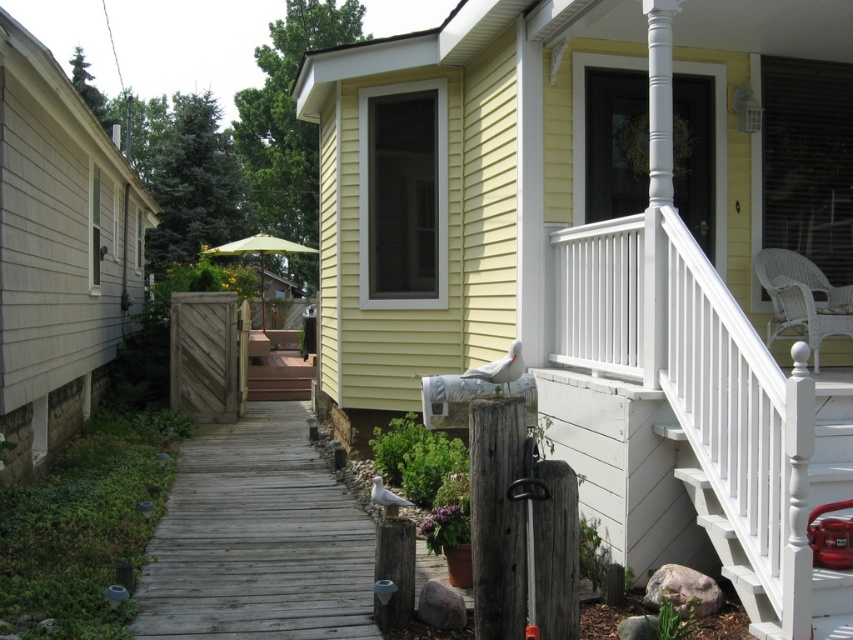
Is weathered wood deck at center to the right of white painted wood stairs at upper right from the viewer's perspective?

No, weathered wood deck at center is not to the right of white painted wood stairs at upper right.

Does weathered wood deck at center appear under white painted wood stairs at upper right?

Yes, weathered wood deck at center is below white painted wood stairs at upper right.

Who is more forward, [312,547] or [804,376]?

Point [804,376] is in front.

Identify the location of weathered wood deck at center. (257, 540).

Is point (799, 387) behind point (488, 435)?

No, it is in front of (488, 435).

Who is more distant from viewer, (697, 465) or (480, 563)?

The point (697, 465) is behind.

Measure the distance between white painted wood stairs at upper right and camera.

white painted wood stairs at upper right and camera are 11.48 feet apart.

This screenshot has height=640, width=853. Find the location of `white painted wood stairs at upper right`. white painted wood stairs at upper right is located at coordinates (780, 509).

Is point (294, 524) closer to viewer compared to point (471, 493)?

No, it is behind (471, 493).

Does point (247, 454) come farther from viewer compared to point (494, 538)?

That is True.

Find the location of a particular element. Image resolution: width=853 pixels, height=640 pixels. weathered wood deck at center is located at coordinates (257, 540).